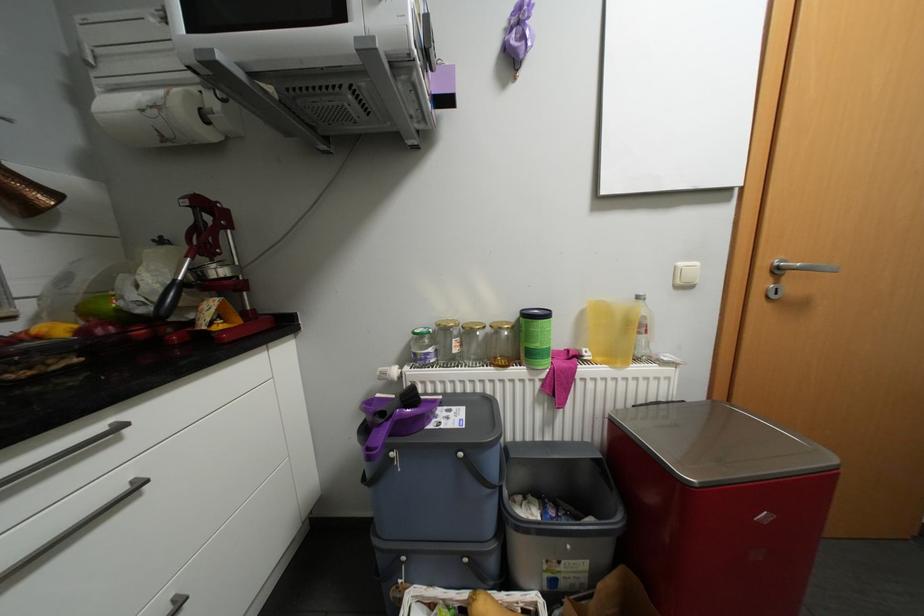
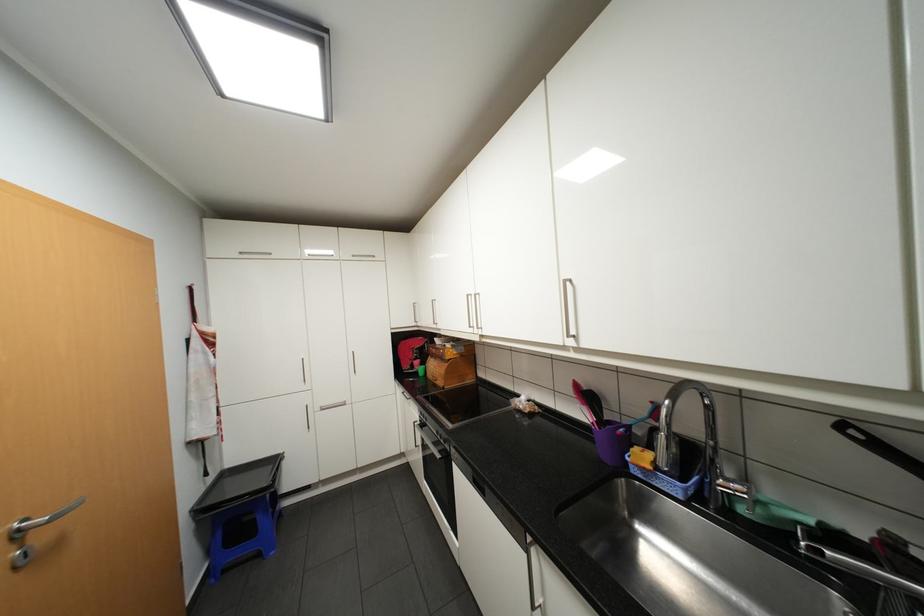
Where in the second image is the point corresponding to point 784,265 from the first image?

(27, 530)